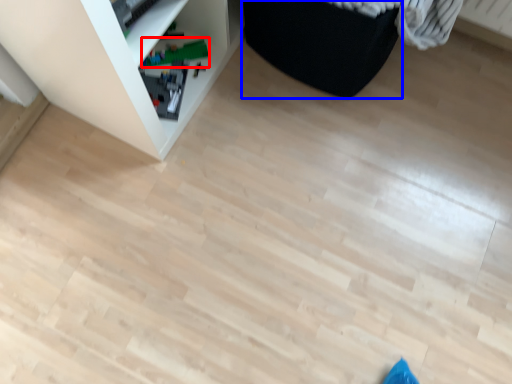
Question: Among these objects, which one is nearest to the camera, toy (highlighted by a red box) or furniture (highlighted by a blue box)?

Choices:
 (A) toy
 (B) furniture

Answer: (B)